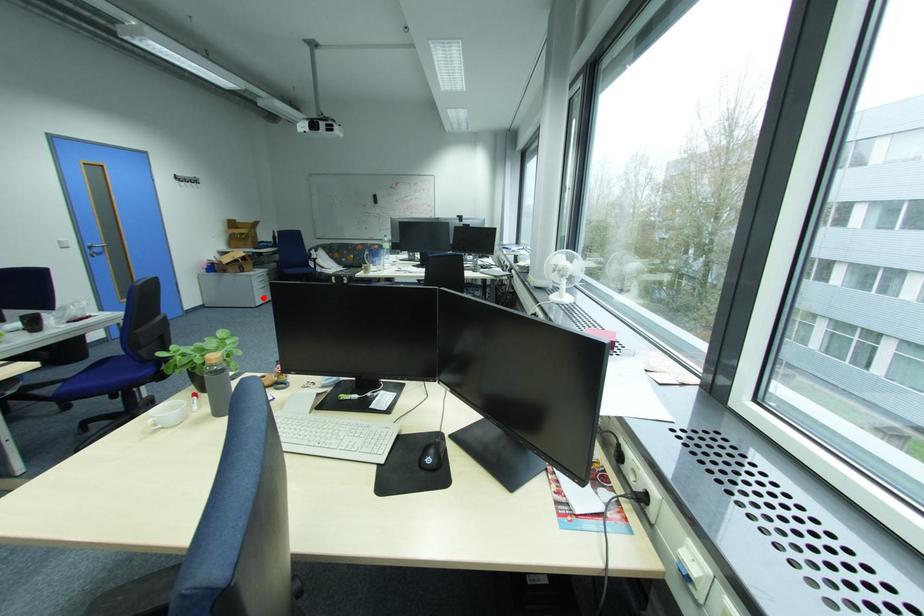
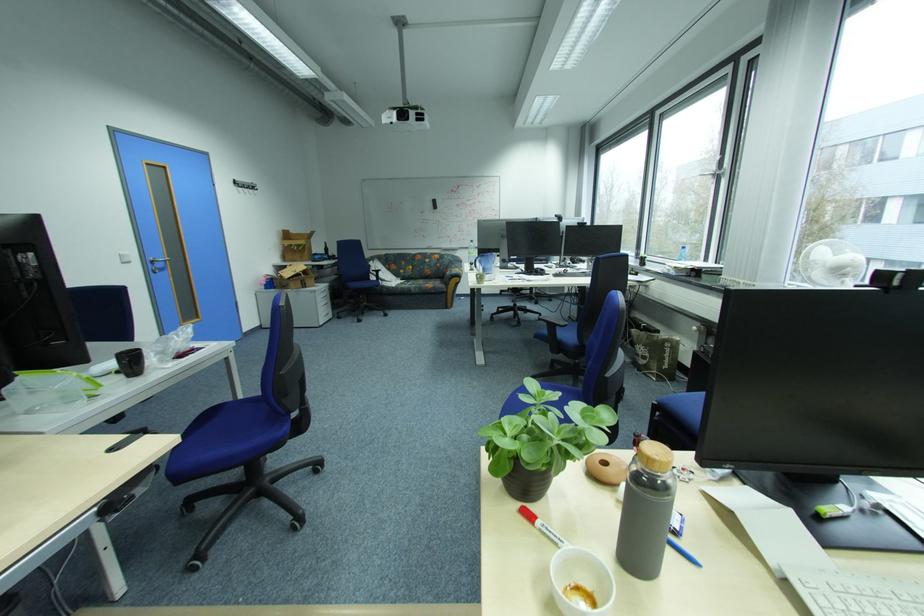
Question: I am providing you with two images of the same scene from different viewpoints. Image1 has a red point marked. In image2, the corresponding 3D location appears at what relative position? Reply with the corresponding letter.

Choices:
 (A) Closer
 (B) Farther

Answer: (A)